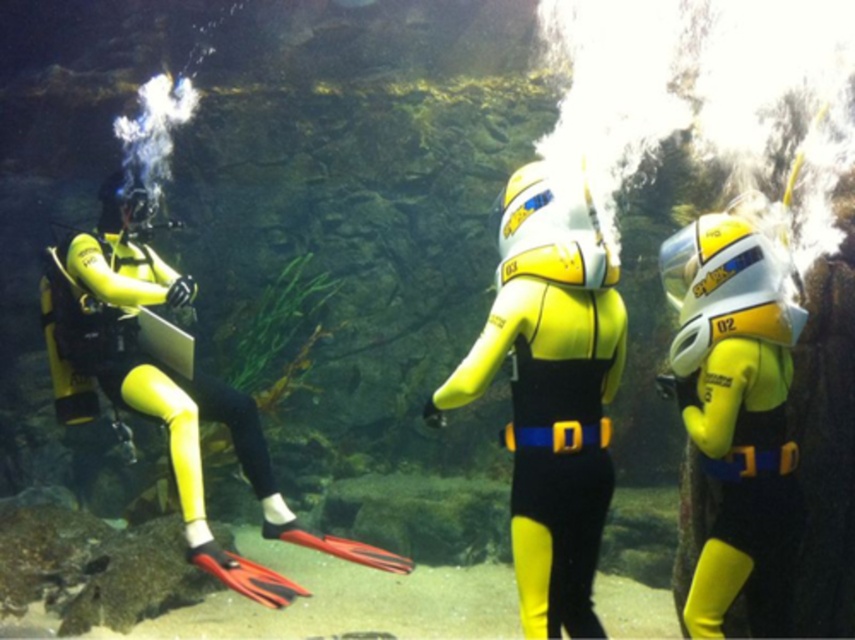
You are a marine biologist observing the underwater scene. You need to place a 20 inch long measuring tape between the yellow matte wetsuit at center and the yellow matte scuba suit at right. Will the tape be long enough to reach both ends?

The yellow matte wetsuit at center is 21.42 inches from the yellow matte scuba suit at right. The 20 inch measuring tape is shorter than the distance between them, so it won not be long enough to reach both ends.

Based on the scene description, where is the yellow matte scuba suit at right located in terms of its 2D coordinates?

The yellow matte scuba suit at right is located at the 2D coordinates of point (736, 412).